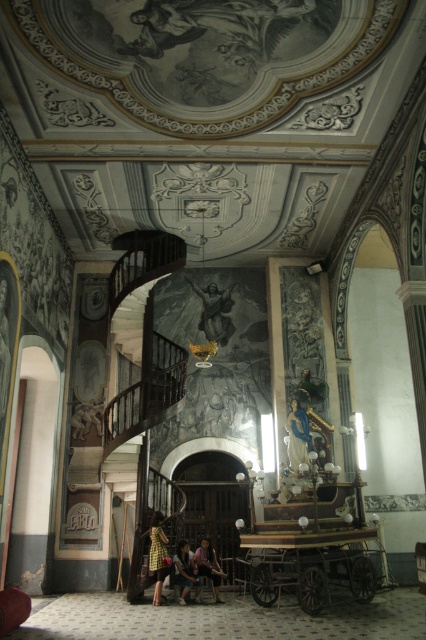
Which is more to the left, wooden wagon at center or blue fabric statue at center?

wooden wagon at center is more to the left.

Can you confirm if wooden wagon at center is positioned below blue fabric statue at center?

Yes.

This screenshot has width=426, height=640. Identify the location of wooden wagon at center. coord(310,564).

Is the position of light brown fabric skirt at lower center less distant than that of dark brown leather chair at center?

Yes, it is.

Is light brown fabric skirt at lower center positioned behind dark brown leather chair at center?

No, it is in front of dark brown leather chair at center.

Does point (184, 547) come farther from viewer compared to point (213, 560)?

No, it is not.

Identify the location of light brown fabric skirt at lower center. This screenshot has width=426, height=640. pos(184,572).

Can you confirm if blue fabric statue at center is thinner than dark brown leather chair at center?

Yes, blue fabric statue at center is thinner than dark brown leather chair at center.

Who is lower down, blue fabric statue at center or dark brown leather chair at center?

dark brown leather chair at center is lower down.

Locate an element on the screen. blue fabric statue at center is located at coordinates 298,435.